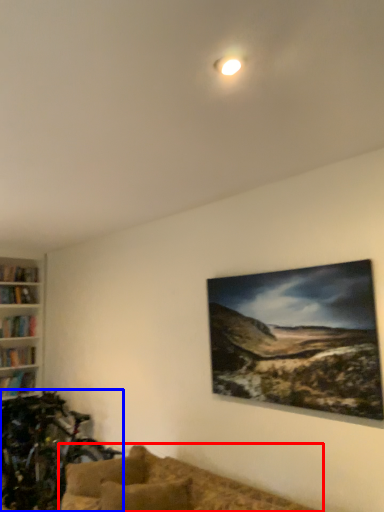
Question: Which object appears farthest to the camera in this image, studio couch (highlighted by a red box) or mountain bike (highlighted by a blue box)?

Choices:
 (A) studio couch
 (B) mountain bike

Answer: (B)